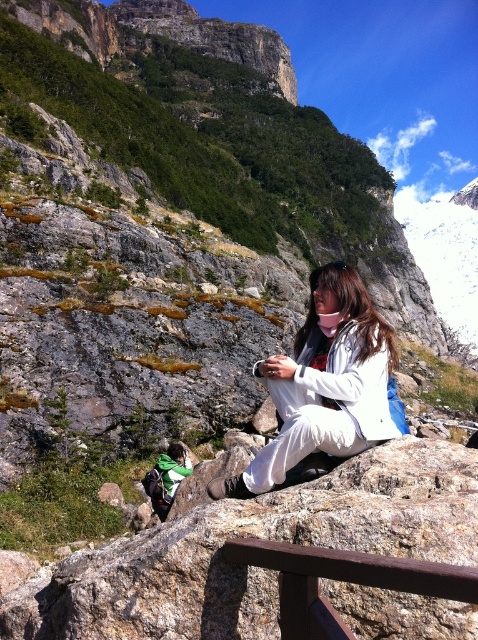
Question: Which of the following is the closest to the observer?

Choices:
 (A) white matte jacket at center
 (B) brown wood rail at lower center

Answer: (B)

Question: Does white matte jacket at center have a greater width compared to brown wood rail at lower center?

Choices:
 (A) no
 (B) yes

Answer: (B)

Question: Is white matte jacket at center closer to camera compared to brown wood rail at lower center?

Choices:
 (A) no
 (B) yes

Answer: (A)

Question: Is white matte jacket at center behind brown wood rail at lower center?

Choices:
 (A) yes
 (B) no

Answer: (A)

Question: Which point appears farthest from the camera in this image?

Choices:
 (A) (231, 548)
 (B) (338, 419)

Answer: (B)

Question: Which of the following is the closest to the observer?

Choices:
 (A) (270, 561)
 (B) (337, 348)

Answer: (A)